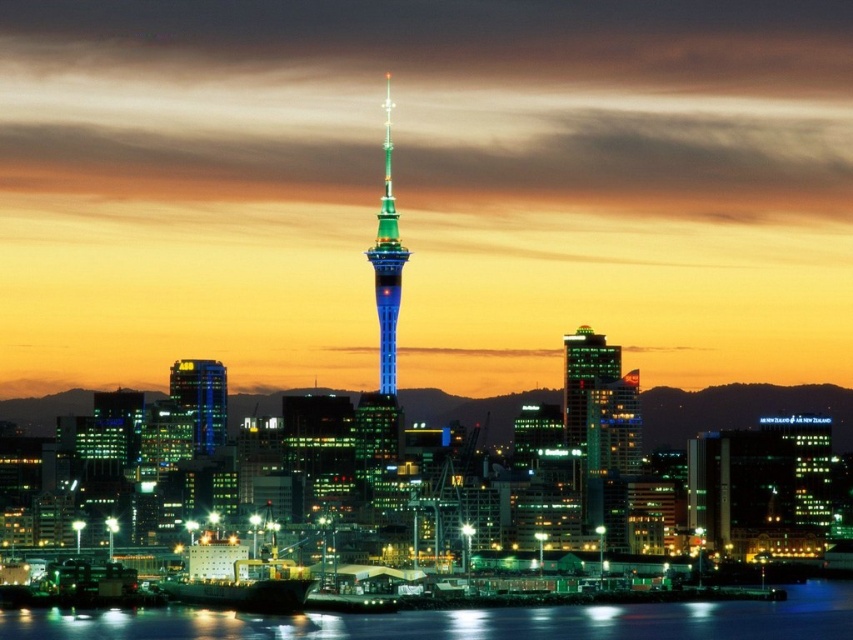
Who is positioned more to the left, shiny glass tower at center or matte glass skyscraper at center-left?

From the viewer's perspective, matte glass skyscraper at center-left appears more on the left side.

Can you confirm if shiny glass tower at center is thinner than matte glass skyscraper at center-left?

Yes, shiny glass tower at center is thinner than matte glass skyscraper at center-left.

Which is in front, point (389, 385) or point (198, 394)?

Point (389, 385)

The image size is (853, 640). I want to click on shiny glass tower at center, so click(x=387, y=264).

Is glossy water at lower center further to camera compared to green glass skyscraper at center?

That is True.

Does point (821, 620) come farther from viewer compared to point (599, 346)?

Yes, it is behind point (599, 346).

Describe the element at coordinates (466, 621) in the screenshot. The width and height of the screenshot is (853, 640). I see `glossy water at lower center` at that location.

Locate an element on the screen. The height and width of the screenshot is (640, 853). glossy water at lower center is located at coordinates (466, 621).

Can you confirm if shiny glass tower at center is smaller than green glass skyscraper at center?

Incorrect, shiny glass tower at center is not smaller in size than green glass skyscraper at center.

Where is `shiny glass tower at center`? Image resolution: width=853 pixels, height=640 pixels. shiny glass tower at center is located at coordinates (387, 264).

Where is `shiny glass tower at center`? The image size is (853, 640). shiny glass tower at center is located at coordinates (387, 264).